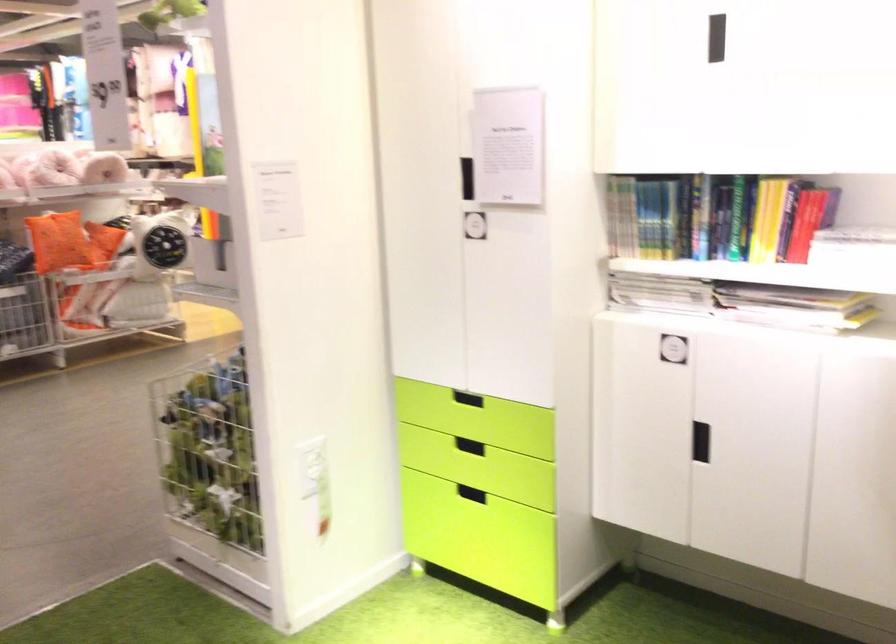
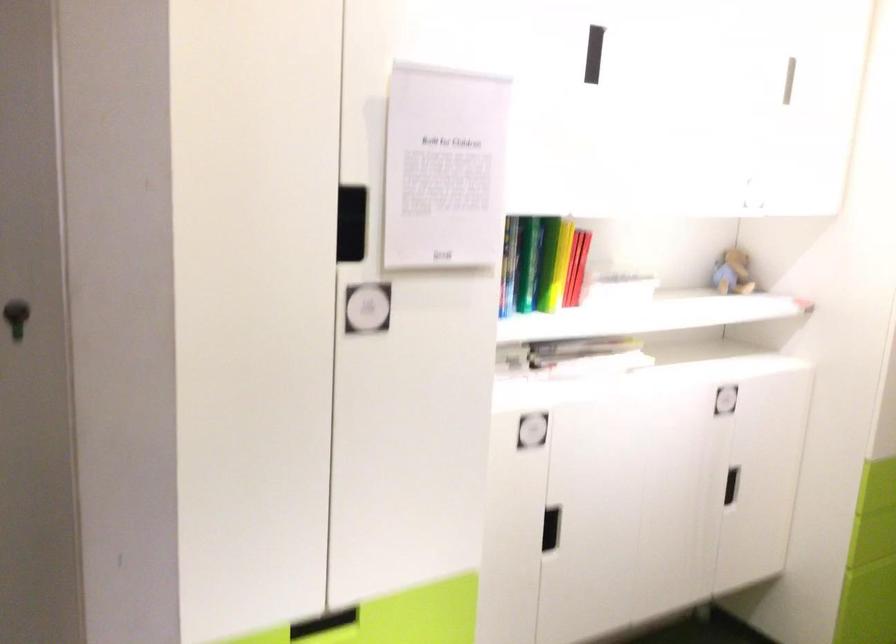
The point at (x=810, y=220) is marked in the first image. Where is the corresponding point in the second image?

(576, 267)